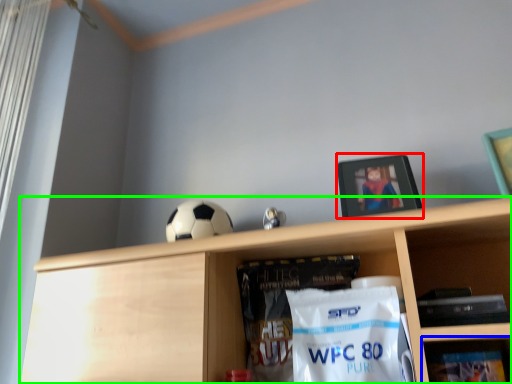
Question: Based on their relative distances, which object is farther from picture frame (highlighted by a red box)? Choose from shelf (highlighted by a blue box) and shelf (highlighted by a green box).

Choices:
 (A) shelf
 (B) shelf

Answer: (A)